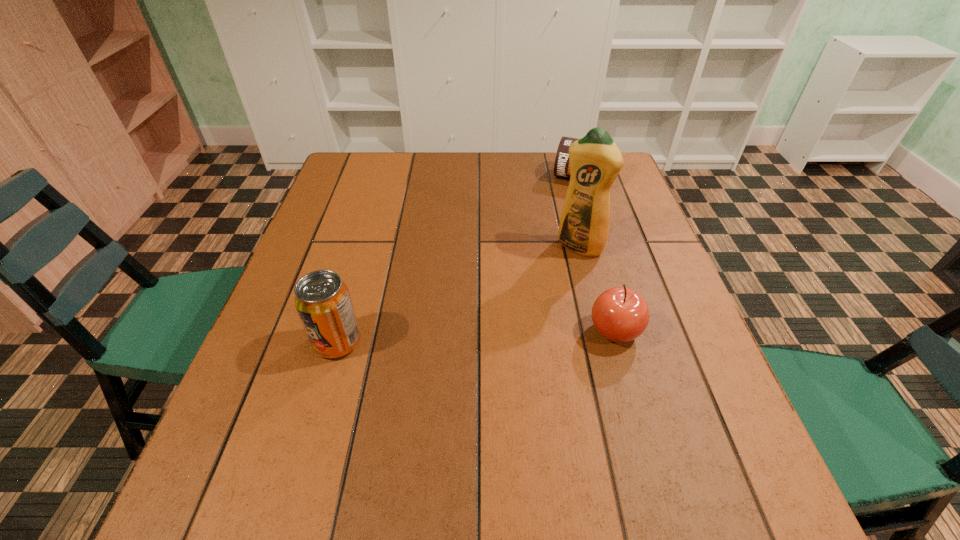
The image size is (960, 540). What are the coordinates of `free spot between the soda can and the can` in the screenshot? It's located at (459, 260).

The width and height of the screenshot is (960, 540). What are the coordinates of `free space between the soda can and the tallest object` in the screenshot? It's located at (459, 294).

Where is `object that stands as the closest to the tallest object`? object that stands as the closest to the tallest object is located at coordinates (619, 314).

Locate an element on the screen. object that is the third closest one to the detergent is located at coordinates 322,300.

Find the location of a particular element. This screenshot has height=540, width=960. vacant space that satisfies the following two spatial constraints: 1. on the back side of the leftmost object; 2. on the right side of the farthest object is located at coordinates (385, 178).

Locate an element on the screen. The image size is (960, 540). vacant space that satisfies the following two spatial constraints: 1. on the back side of the third shortest object; 2. on the right side of the apple is located at coordinates (341, 330).

At what (x,y) coordinates should I click in order to perform the action: click on free space that satisfies the following two spatial constraints: 1. on the back side of the third nearest object; 2. on the right side of the soda can. Please return your answer as a coordinate pair (x, y). The width and height of the screenshot is (960, 540). Looking at the image, I should click on pos(365,247).